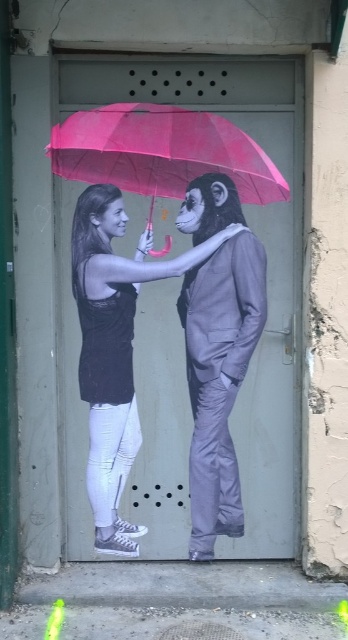
Question: Is matte black suit at center below pink matte umbrella at upper center?

Choices:
 (A) yes
 (B) no

Answer: (A)

Question: Which point appears closest to the camera in this image?

Choices:
 (A) (236, 509)
 (B) (90, 301)
 (C) (65, 132)

Answer: (C)

Question: Is metallic gray suit at center closer to the viewer compared to matte black suit at center?

Choices:
 (A) yes
 (B) no

Answer: (B)

Question: Is metallic gray suit at center to the left of matte black suit at center from the viewer's perspective?

Choices:
 (A) no
 (B) yes

Answer: (A)

Question: Based on their relative distances, which object is farther from the pink matte umbrella at upper center?

Choices:
 (A) metallic gray suit at center
 (B) matte black suit at center

Answer: (A)

Question: Which is nearer to the matte black suit at center?

Choices:
 (A) pink matte umbrella at upper center
 (B) metallic gray suit at center

Answer: (B)